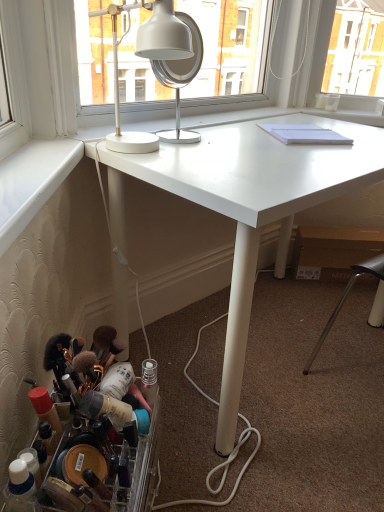
Question: Is translucent plastic container at lower left looking in the opposite direction of white metallic mirror at upper center?

Choices:
 (A) no
 (B) yes

Answer: (A)

Question: From a real-world perspective, is translucent plastic container at lower left positioned under white metallic mirror at upper center based on gravity?

Choices:
 (A) yes
 (B) no

Answer: (A)

Question: From a real-world perspective, is translucent plastic container at lower left located higher than white metallic mirror at upper center?

Choices:
 (A) no
 (B) yes

Answer: (A)

Question: Is white metallic mirror at upper center inside translucent plastic container at lower left?

Choices:
 (A) yes
 (B) no

Answer: (B)

Question: Does translucent plastic container at lower left have a greater width compared to white metallic mirror at upper center?

Choices:
 (A) yes
 (B) no

Answer: (A)

Question: Considering the positions of white metallic mirror at upper center and translucent plastic container at lower left in the image, is white metallic mirror at upper center bigger or smaller than translucent plastic container at lower left?

Choices:
 (A) small
 (B) big

Answer: (A)

Question: Considering the relative positions of white metallic mirror at upper center and translucent plastic container at lower left in the image provided, is white metallic mirror at upper center to the left or to the right of translucent plastic container at lower left?

Choices:
 (A) right
 (B) left

Answer: (A)

Question: Considering the positions of point (193, 25) and point (132, 466), is point (193, 25) closer or farther from the camera than point (132, 466)?

Choices:
 (A) farther
 (B) closer

Answer: (A)

Question: Is white metallic mirror at upper center situated inside translucent plastic container at lower left or outside?

Choices:
 (A) inside
 (B) outside

Answer: (B)

Question: Considering the positions of translucent plastic container at lower left and white matte desk at center in the image, is translucent plastic container at lower left wider or thinner than white matte desk at center?

Choices:
 (A) thin
 (B) wide

Answer: (A)

Question: Does point (56, 372) appear closer or farther from the camera than point (200, 163)?

Choices:
 (A) closer
 (B) farther

Answer: (A)

Question: Is translucent plastic container at lower left inside or outside of white matte desk at center?

Choices:
 (A) inside
 (B) outside

Answer: (B)

Question: In the image, is translucent plastic container at lower left positioned in front of or behind white matte desk at center?

Choices:
 (A) behind
 (B) front

Answer: (B)

Question: Does point [104, 480] appear closer or farther from the camera than point [160, 46]?

Choices:
 (A) closer
 (B) farther

Answer: (A)

Question: From a real-world perspective, is translucent plastic container at lower left above or below white glossy desk lamp at upper center?

Choices:
 (A) above
 (B) below

Answer: (B)